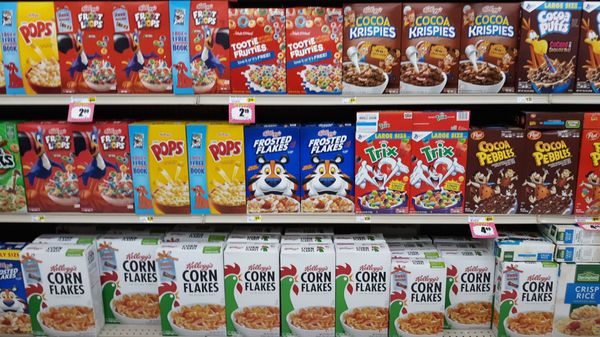
The width and height of the screenshot is (600, 337). I want to click on cocoa flavored cereal box, so click(361, 65), click(423, 55), click(483, 47), click(485, 169), click(555, 172), click(541, 61), click(589, 58), click(552, 117).